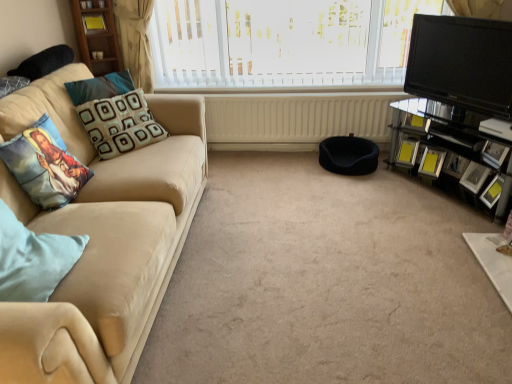
I want to click on free space to the left of matte black picture frame at right, which is counted as the 3th picture frame, starting from the front, so click(x=460, y=188).